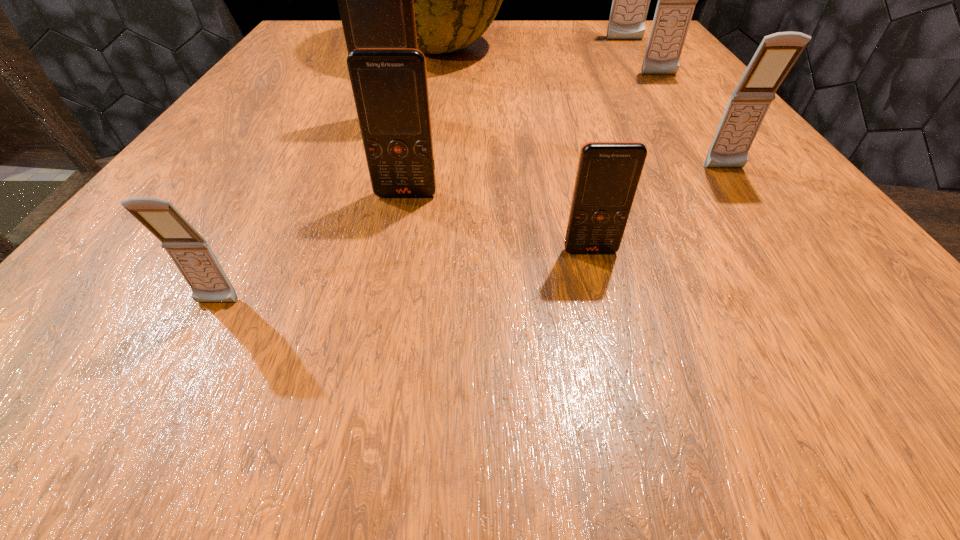
The height and width of the screenshot is (540, 960). Find the location of `the tallest object`. the tallest object is located at coordinates (455, 0).

In order to click on watermelon in this screenshot , I will do (x=455, y=0).

This screenshot has height=540, width=960. Identify the location of the tallest cellular telephone. (631, 0).

Where is `the second tallest object`? the second tallest object is located at coordinates (631, 0).

Find the location of a particular element. Image resolution: width=960 pixels, height=540 pixels. the second farthest cellular telephone is located at coordinates (676, 0).

The height and width of the screenshot is (540, 960). What are the coordinates of `the third smallest gray cellular telephone` in the screenshot? It's located at (676, 0).

The width and height of the screenshot is (960, 540). I want to click on the fourth farthest object, so click(x=375, y=0).

You are a GUI agent. You are given a task and a screenshot of the screen. Output one action in this format:
    pyautogui.click(x=<x>, y=<y>)
    Task: Click on the biggest orange cellular telephone
    
    Given the screenshot: What is the action you would take?
    pyautogui.click(x=375, y=0)

Where is `the second nearest gray cellular telephone`? This screenshot has width=960, height=540. the second nearest gray cellular telephone is located at coordinates (777, 53).

This screenshot has width=960, height=540. I want to click on the fourth nearest cellular telephone, so click(777, 53).